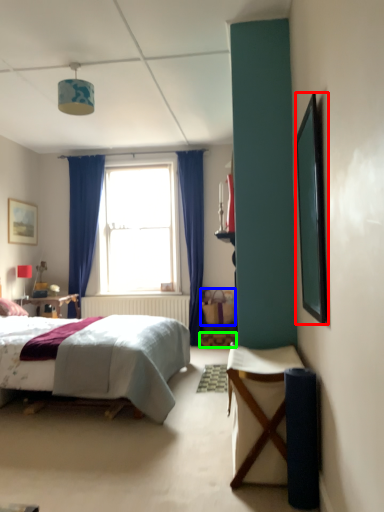
Question: Which is farther away from picture frame (highlighted by a red box)? picnic basket (highlighted by a blue box) or stool (highlighted by a green box)?

Choices:
 (A) picnic basket
 (B) stool

Answer: (B)